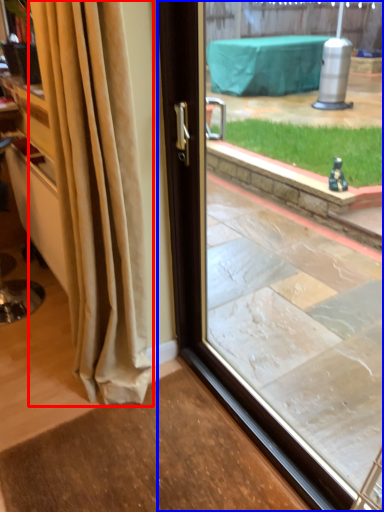
Question: Which of the following is the farthest to the observer, curtain (highlighted by a red box) or window (highlighted by a blue box)?

Choices:
 (A) curtain
 (B) window

Answer: (A)